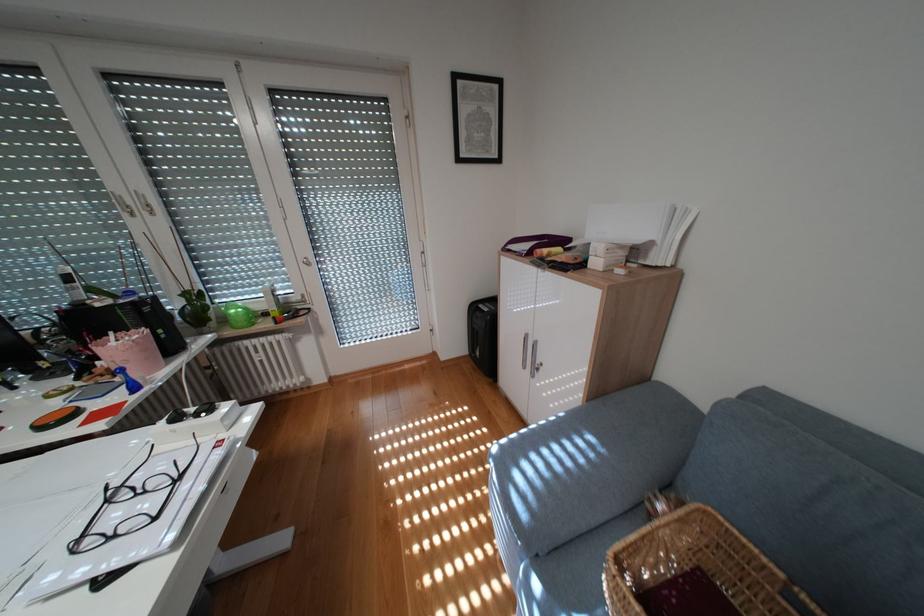
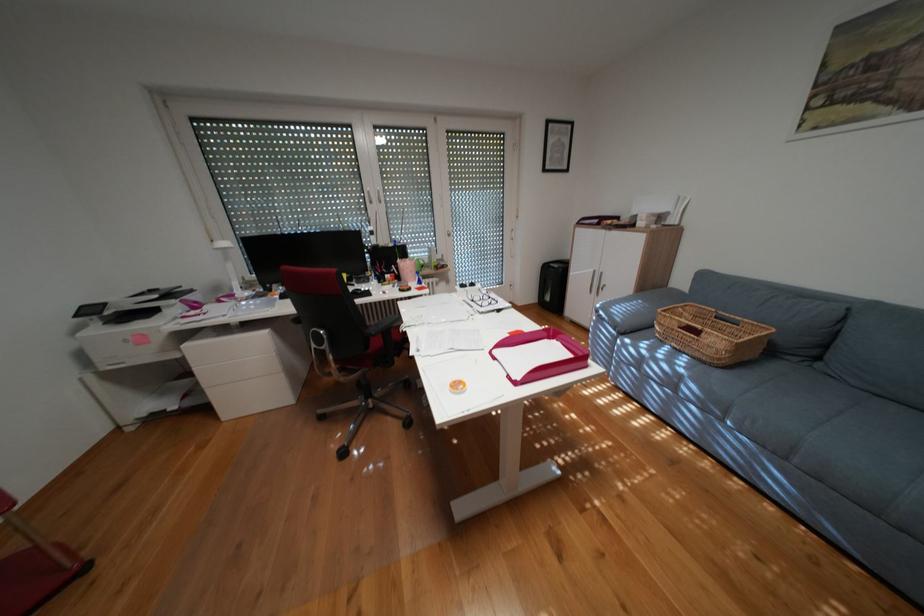
In the second image, find the point that corresponds to [188,418] in the first image.

(476, 286)